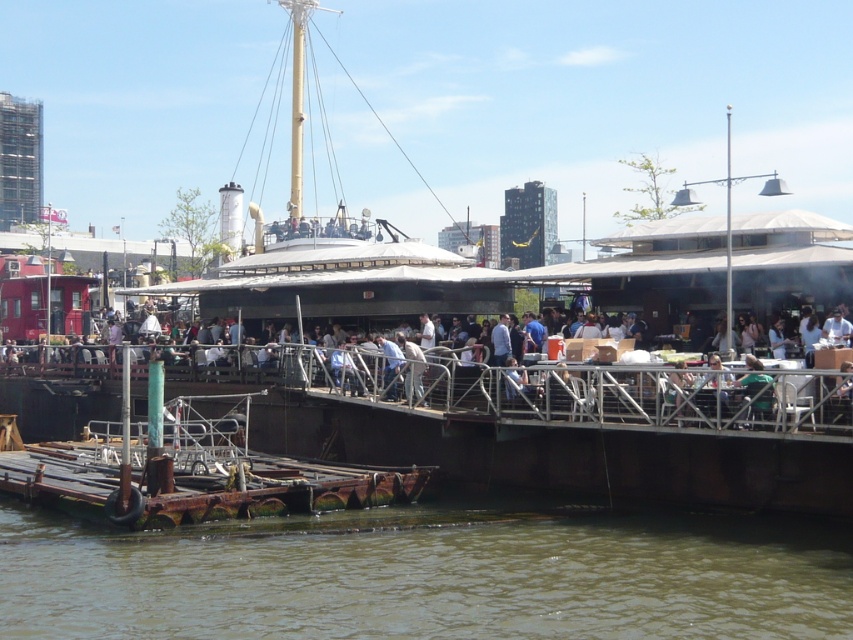
Question: Is white plastic chair at center to the left of green fabric chair at center from the viewer's perspective?

Choices:
 (A) yes
 (B) no

Answer: (A)

Question: Which of these objects is positioned farthest from the brown murky water at lower center?

Choices:
 (A) green fabric chair at center
 (B) white plastic chair at center

Answer: (B)

Question: Which object appears farthest from the camera in this image?

Choices:
 (A) green fabric chair at center
 (B) white plastic chair at center

Answer: (A)

Question: Does brown murky water at lower center appear over green fabric chair at center?

Choices:
 (A) no
 (B) yes

Answer: (A)

Question: Where is brown murky water at lower center located in relation to green fabric chair at center in the image?

Choices:
 (A) above
 (B) below

Answer: (B)

Question: Which is nearer to the white plastic chair at center?

Choices:
 (A) green fabric chair at center
 (B) brown murky water at lower center

Answer: (A)